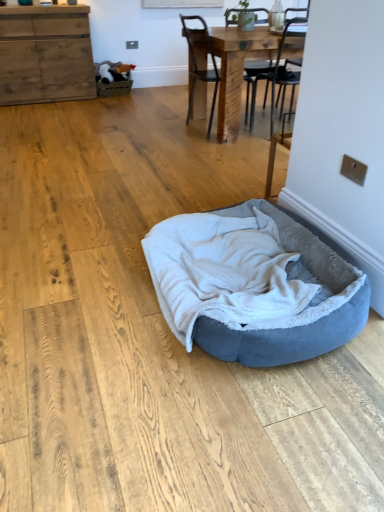
Question: Is soft gray plush dog bed at center taller than wooden table at center?

Choices:
 (A) yes
 (B) no

Answer: (B)

Question: Does soft gray plush dog bed at center have a lesser height compared to wooden table at center?

Choices:
 (A) no
 (B) yes

Answer: (B)

Question: Is wooden table at center at the back of soft gray plush dog bed at center?

Choices:
 (A) no
 (B) yes

Answer: (A)

Question: From the image's perspective, does soft gray plush dog bed at center appear lower than wooden table at center?

Choices:
 (A) yes
 (B) no

Answer: (A)

Question: Is wooden table at center inside soft gray plush dog bed at center?

Choices:
 (A) no
 (B) yes

Answer: (A)

Question: Looking at their shapes, would you say wooden table at center is wider or thinner than black metal chair at upper center?

Choices:
 (A) thin
 (B) wide

Answer: (B)

Question: Choose the correct answer: Is wooden table at center inside black metal chair at upper center or outside it?

Choices:
 (A) inside
 (B) outside

Answer: (B)

Question: From a real-world perspective, is wooden table at center positioned above or below black metal chair at upper center?

Choices:
 (A) below
 (B) above

Answer: (A)

Question: From the image's perspective, is wooden table at center positioned above or below black metal chair at upper center?

Choices:
 (A) below
 (B) above

Answer: (B)

Question: Is black metal chair at upper center wider or thinner than wooden cabinet at upper left?

Choices:
 (A) wide
 (B) thin

Answer: (A)

Question: Considering the positions of black metal chair at upper center and wooden cabinet at upper left in the image, is black metal chair at upper center bigger or smaller than wooden cabinet at upper left?

Choices:
 (A) big
 (B) small

Answer: (B)

Question: Is black metal chair at upper center to the left or to the right of wooden cabinet at upper left in the image?

Choices:
 (A) left
 (B) right

Answer: (B)

Question: Considering the positions of point (193, 47) and point (26, 82), is point (193, 47) closer or farther from the camera than point (26, 82)?

Choices:
 (A) closer
 (B) farther

Answer: (A)

Question: From the image's perspective, is black metal chair at upper center positioned above or below soft gray plush dog bed at center?

Choices:
 (A) above
 (B) below

Answer: (A)

Question: Is black metal chair at upper center situated inside soft gray plush dog bed at center or outside?

Choices:
 (A) outside
 (B) inside

Answer: (A)